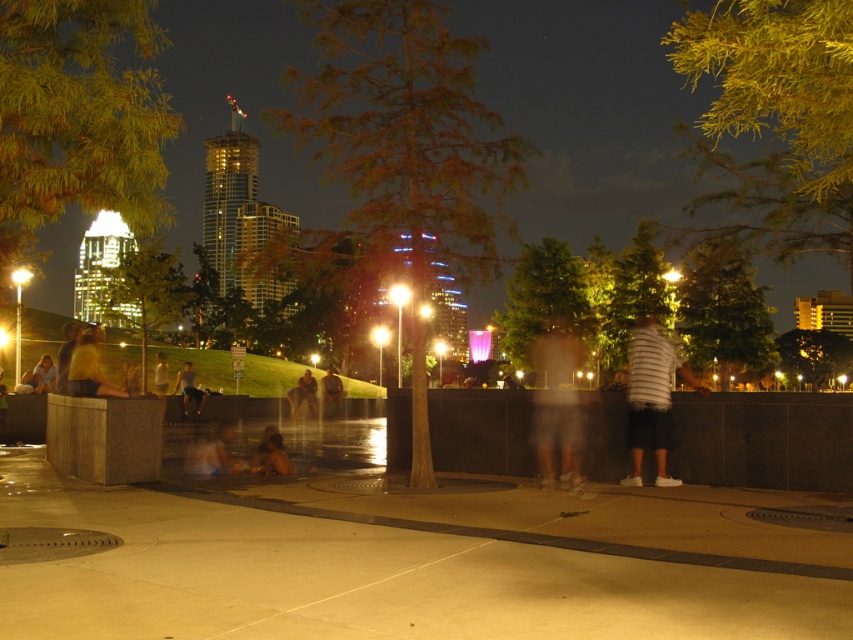
Question: Is smooth concrete pavement at center above light brown wooden skateboard at center?

Choices:
 (A) yes
 (B) no

Answer: (B)

Question: Is smooth concrete pavement at center positioned at the back of white striped shirt at center?

Choices:
 (A) yes
 (B) no

Answer: (B)

Question: Which of these objects is positioned farthest from the light brown wooden skateboard at center?

Choices:
 (A) white striped shirt at center
 (B) yellow fabric shirt at left

Answer: (A)

Question: Which of the following is the closest to the observer?

Choices:
 (A) white striped shirt at center
 (B) yellow fabric shirt at left
 (C) light brown wooden skateboard at center
 (D) smooth concrete pavement at center

Answer: (D)

Question: Which point is farther to the camera?

Choices:
 (A) light brown wooden skateboard at center
 (B) white striped shirt at center
 (C) smooth concrete pavement at center

Answer: (A)

Question: Does smooth concrete pavement at center have a smaller size compared to light brown wooden skateboard at center?

Choices:
 (A) no
 (B) yes

Answer: (B)